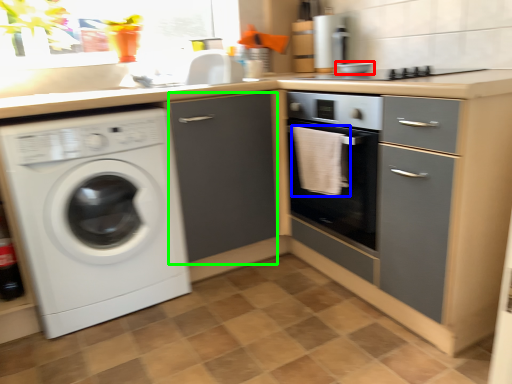
Question: Which object is the farthest from appliance (highlighted by a red box)? Choose among these: material (highlighted by a blue box) or file cabinet (highlighted by a green box).

Choices:
 (A) material
 (B) file cabinet

Answer: (B)